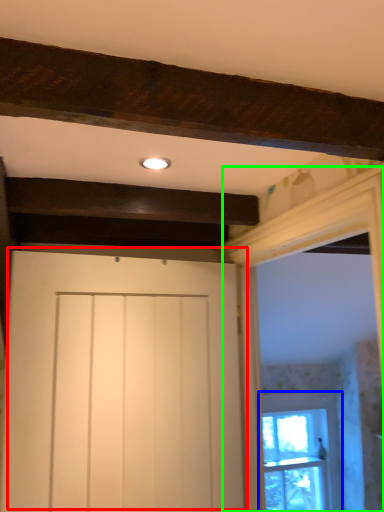
Question: Which object is positioned closest to door (highlighted by a red box)? Select from window (highlighted by a blue box) and window frame (highlighted by a green box).

Choices:
 (A) window
 (B) window frame

Answer: (B)